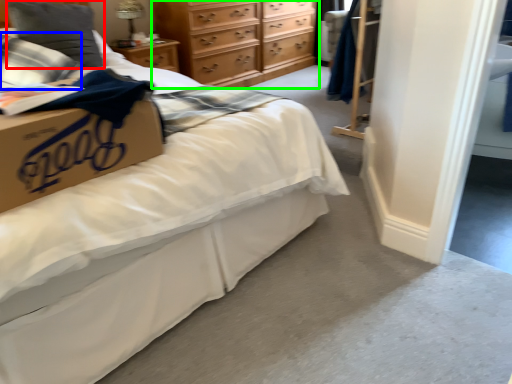
Question: Which object is positioned farthest from pillow (highlighted by a red box)? Select from pillow (highlighted by a blue box) and chest of drawers (highlighted by a green box).

Choices:
 (A) pillow
 (B) chest of drawers

Answer: (B)